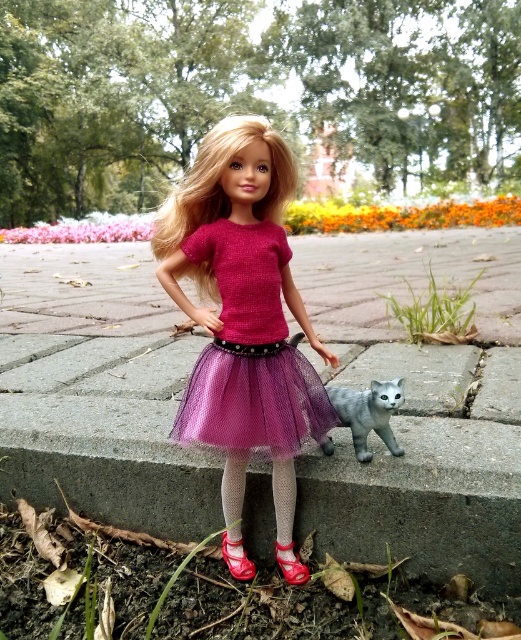
At what (x,y) coordinates should I click in order to perform the action: click on matte pink tulle skirt at center. Please return your answer as a coordinate pair (x, y). Looking at the image, I should click on (242, 312).

Does matte pink tulle skirt at center lie behind shiny pink leather shoe at lower center?

No, matte pink tulle skirt at center is closer to the viewer.

Where is `matte pink tulle skirt at center`? matte pink tulle skirt at center is located at coordinates (242, 312).

At what (x,y) coordinates should I click in order to perform the action: click on matte pink tulle skirt at center. Please return your answer as a coordinate pair (x, y). This screenshot has width=521, height=640. Looking at the image, I should click on click(x=242, y=312).

What do you see at coordinates (242, 312) in the screenshot?
I see `matte pink tulle skirt at center` at bounding box center [242, 312].

Looking at this image, can you confirm if matte pink tulle skirt at center is positioned to the left of shiny red shoe at lower center?

Incorrect, matte pink tulle skirt at center is not on the left side of shiny red shoe at lower center.

Where is `matte pink tulle skirt at center`? matte pink tulle skirt at center is located at coordinates (242, 312).

What do you see at coordinates (242, 312) in the screenshot? The width and height of the screenshot is (521, 640). I see `matte pink tulle skirt at center` at bounding box center [242, 312].

Find the location of a particular element. The height and width of the screenshot is (640, 521). matte pink tulle skirt at center is located at coordinates (242, 312).

Image resolution: width=521 pixels, height=640 pixels. Identify the location of matte pink tulle skirt at center. (242, 312).

Locate an element on the screen. matte pink tulle skirt at center is located at coordinates (242, 312).